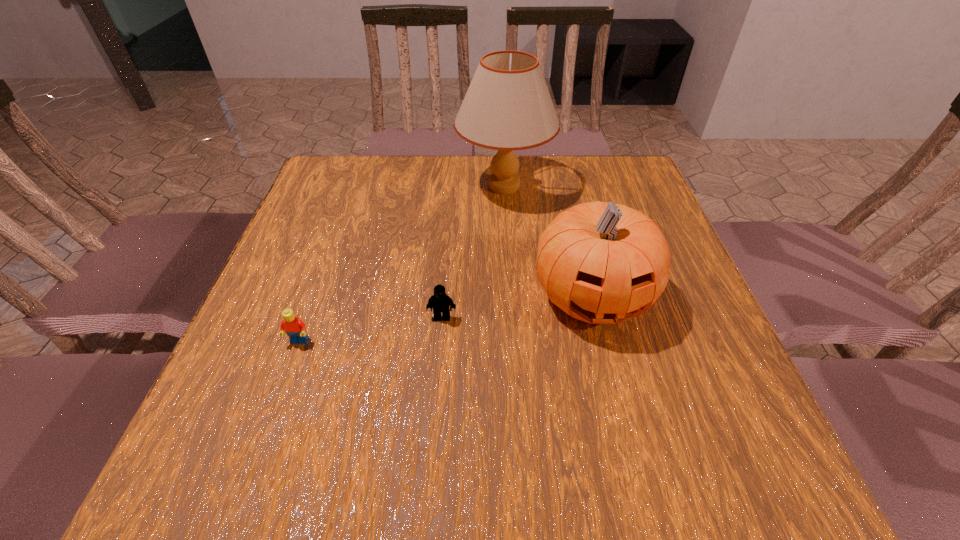
What are the coordinates of `free location at the near right corner of the desktop` in the screenshot? It's located at (696, 471).

Identify the location of free point between the farther Lego and the left Lego. The width and height of the screenshot is (960, 540). (371, 329).

This screenshot has height=540, width=960. In order to click on free point between the third shortest object and the right Lego in this screenshot , I will do `click(516, 307)`.

Find the location of a particular element. The width and height of the screenshot is (960, 540). empty location between the right Lego and the leftmost object is located at coordinates (371, 329).

Image resolution: width=960 pixels, height=540 pixels. In order to click on vacant area that lies between the farthest object and the right Lego in this screenshot , I will do point(473,252).

At what (x,y) coordinates should I click in order to perform the action: click on vacant space that's between the farther Lego and the farthest object. Please return your answer as a coordinate pair (x, y). Looking at the image, I should click on pos(473,252).

The width and height of the screenshot is (960, 540). In order to click on vacant area that lies between the right Lego and the farthest object in this screenshot , I will do `click(473, 252)`.

Find the location of a particular element. The image size is (960, 540). object that is the second closest one to the leftmost object is located at coordinates (600, 262).

Where is `the third closest object to the pumpkin`? the third closest object to the pumpkin is located at coordinates (294, 327).